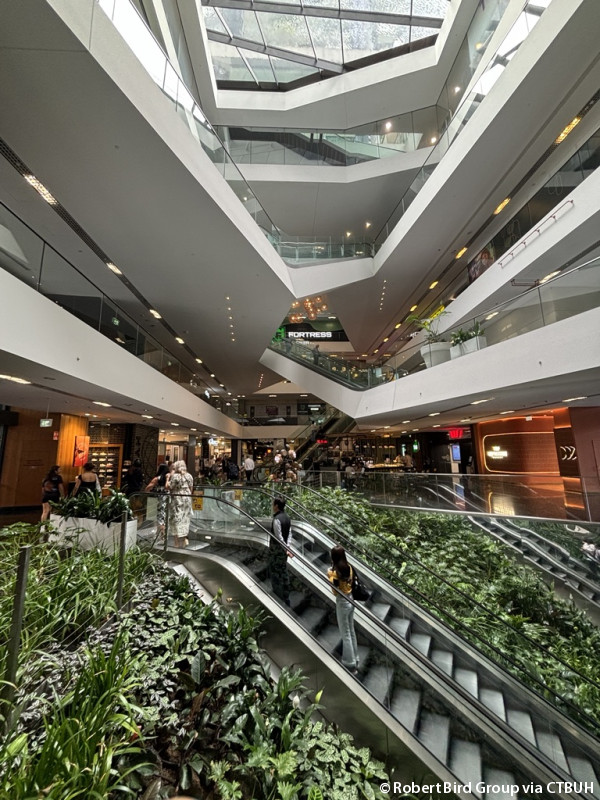
Identify the location of plant container. The image size is (600, 800). (107, 540).